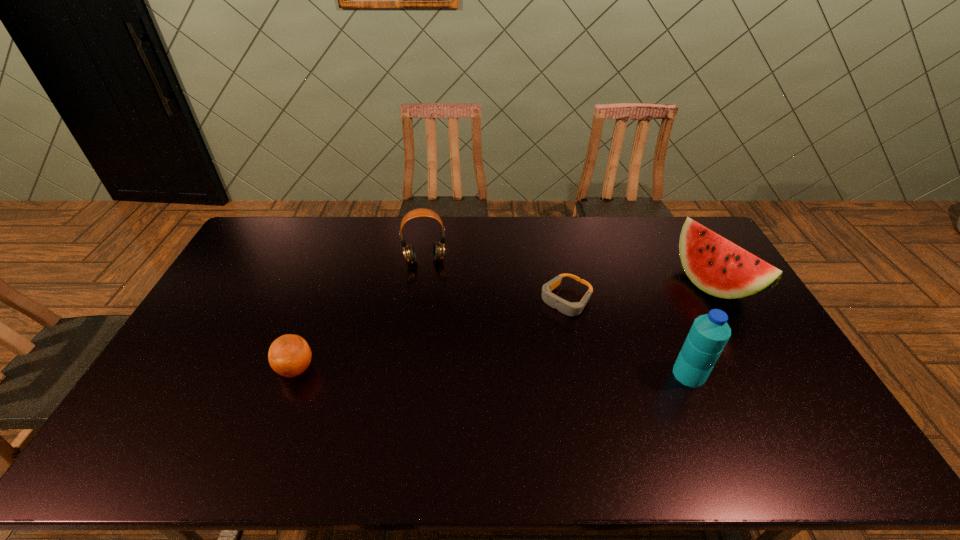
I want to click on the leftmost object, so click(x=289, y=355).

At what (x,y) coordinates should I click in order to perform the action: click on the second shortest object. Please return your answer as a coordinate pair (x, y). Image resolution: width=960 pixels, height=540 pixels. Looking at the image, I should click on (289, 355).

Locate an element on the screen. the second object from right to left is located at coordinates (709, 334).

You are a GUI agent. You are given a task and a screenshot of the screen. Output one action in this format:
    pyautogui.click(x=<x>, y=<y>)
    Task: Click on the fourth object from right to left
    The image size is (960, 540).
    Given the screenshot: What is the action you would take?
    pyautogui.click(x=409, y=253)

This screenshot has height=540, width=960. Find the location of `the rightmost object`. the rightmost object is located at coordinates (717, 266).

You are a GUI agent. You are given a task and a screenshot of the screen. Output one action in this format:
    pyautogui.click(x=<x>, y=<y>)
    Task: Click on the goggles
    The image size is (960, 540).
    Given the screenshot: What is the action you would take?
    pyautogui.click(x=568, y=308)

Identify the location of the shortest object. (568, 308).

You are a GUI agent. You are given a task and a screenshot of the screen. Output one action in this format:
    pyautogui.click(x=<x>, y=<y>)
    Task: Click on the free space located 0.090m on the front of the fourth tallest object
    Image resolution: width=960 pixels, height=540 pixels.
    Given the screenshot: What is the action you would take?
    pyautogui.click(x=278, y=415)

You are a GUI agent. You are given a task and a screenshot of the screen. Output one action in this format:
    pyautogui.click(x=<x>, y=<y>)
    Task: Click on the vacant area situated on the right of the fourth object from left to right
    
    Given the screenshot: What is the action you would take?
    pyautogui.click(x=783, y=374)

You are a GUI agent. You are given a task and a screenshot of the screen. Output one action in this format:
    pyautogui.click(x=<x>, y=<y>)
    Task: Click on the free space located on the ear cups of the second object from left to right
    The width and height of the screenshot is (960, 540).
    Given the screenshot: What is the action you would take?
    pyautogui.click(x=431, y=305)